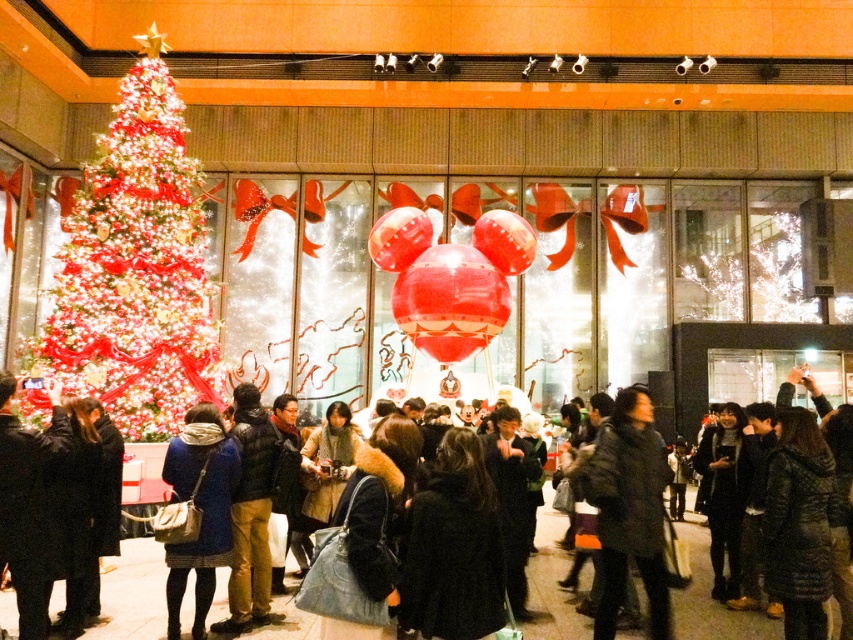
Question: Which point appears closest to the camera in this image?

Choices:
 (A) [115, 444]
 (B) [160, 637]
 (C) [175, 612]
 (D) [184, 196]

Answer: (C)

Question: Where is black wool coat at center located in relation to dark blue coat at center in the image?

Choices:
 (A) left
 (B) right

Answer: (B)

Question: Which point is farther to the camera?

Choices:
 (A) iridescent glass christmas tree at left
 (B) dark blue coat at center
 (C) black fuzzy coat at center
 (D) black wool coat at center

Answer: (A)

Question: Does black fuzzy coat at center have a lesser width compared to blue fabric coat at center?

Choices:
 (A) no
 (B) yes

Answer: (A)

Question: Is iridescent glass christmas tree at left wider than blue fabric coat at center?

Choices:
 (A) yes
 (B) no

Answer: (A)

Question: Which object is positioned farthest from the blue fabric coat at center?

Choices:
 (A) dark blue coat at center
 (B) black wool coat at lower left

Answer: (A)